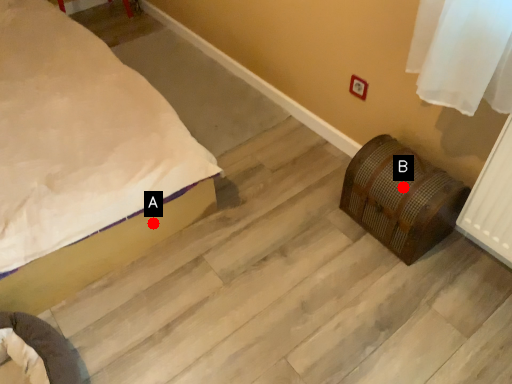
Question: Two points are circled on the image, labeled by A and B beside each circle. Which point is further to the camera?

Choices:
 (A) A is further
 (B) B is further

Answer: (A)